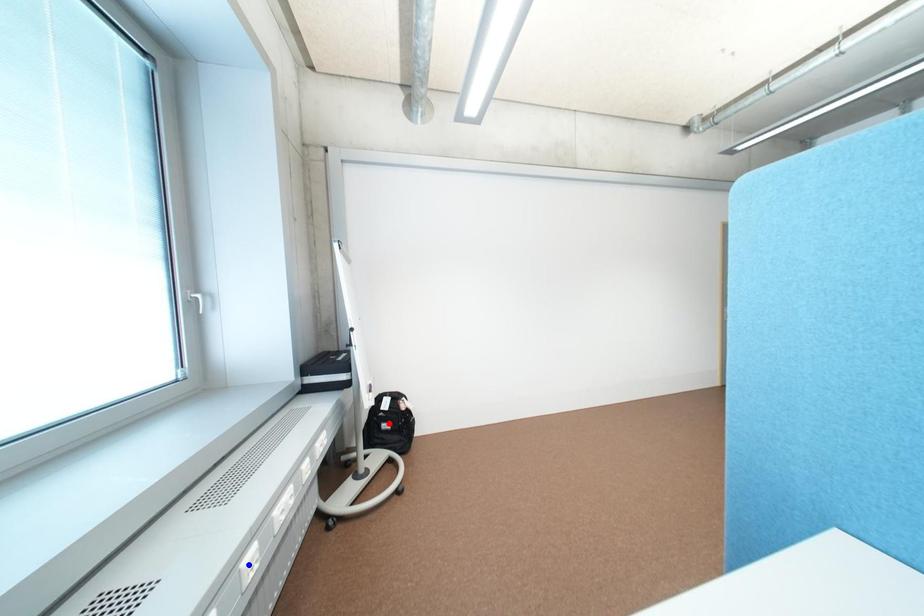
Question: Which of the two points in the image is closer to the camera?

Choices:
 (A) Blue point is closer.
 (B) Red point is closer.

Answer: (A)